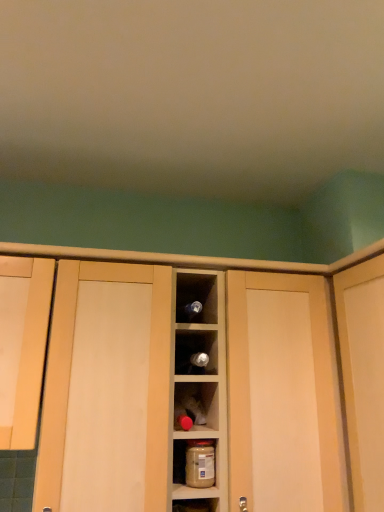
Question: From a real-world perspective, is wooden cabinet at center, the 2th cabinetry from the left, positioned above or below translucent plastic jar at center?

Choices:
 (A) above
 (B) below

Answer: (A)

Question: Based on their sizes in the image, would you say wooden cabinet at center, arranged as the first cabinetry when viewed from the right, is bigger or smaller than translucent plastic jar at center?

Choices:
 (A) big
 (B) small

Answer: (A)

Question: Which object is the farthest from the translucent plastic jar at center?

Choices:
 (A) wooden cabinet at center, the 2th cabinetry from the left
 (B) shiny silver wine bottle at center
 (C) matte wood cabinet at left, which ranks as the 2th cabinetry in right-to-left order
 (D) matte wood door at right

Answer: (A)

Question: Which of these objects is positioned closest to the wooden cabinet at center, arranged as the first cabinetry when viewed from the right?

Choices:
 (A) translucent plastic jar at center
 (B) matte wood cabinet at left, which appears as the 1th cabinetry when viewed from the left
 (C) matte wood door at right
 (D) shiny silver wine bottle at center

Answer: (B)